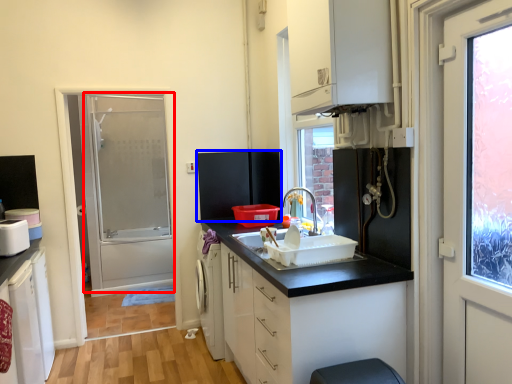
Question: Which point is further to the camera, screen door (highlighted by a red box) or appliance (highlighted by a blue box)?

Choices:
 (A) screen door
 (B) appliance

Answer: (B)